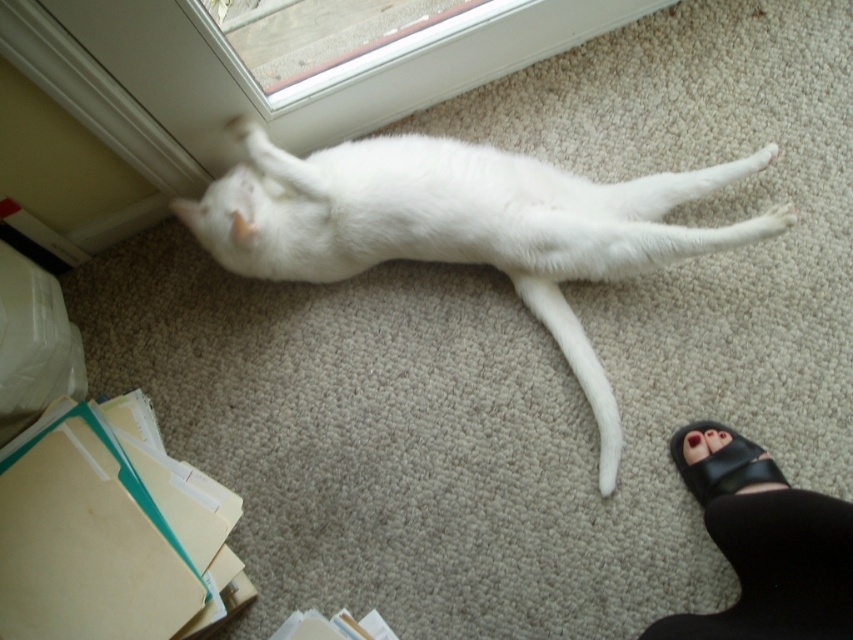
Question: Is black leather sandals at lower right smaller than black leather sandal at lower right?

Choices:
 (A) yes
 (B) no

Answer: (B)

Question: Which object is the farthest from the black leather sandals at lower right?

Choices:
 (A) black leather sandal at lower right
 (B) white fur cat at center

Answer: (B)

Question: Which point is closer to the camera taking this photo?

Choices:
 (A) (750, 548)
 (B) (682, 465)

Answer: (A)

Question: Which object is positioned closest to the white fur cat at center?

Choices:
 (A) black leather sandals at lower right
 (B) black leather sandal at lower right

Answer: (A)

Question: Does white fur cat at center come in front of black leather sandal at lower right?

Choices:
 (A) no
 (B) yes

Answer: (A)

Question: Does white fur cat at center have a smaller size compared to black leather sandals at lower right?

Choices:
 (A) no
 (B) yes

Answer: (A)